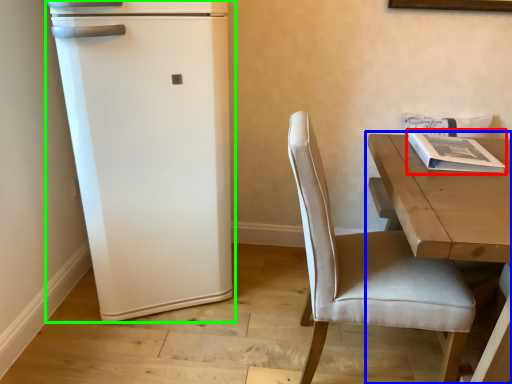
Question: Which object is the closest to the magazine (highlighted by a red box)? Choose among these: table (highlighted by a blue box) or refrigerator (highlighted by a green box).

Choices:
 (A) table
 (B) refrigerator

Answer: (A)